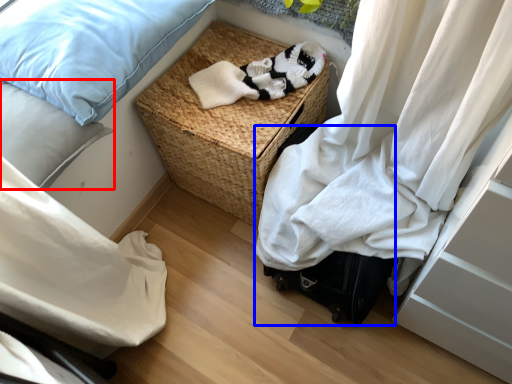
Question: Which object is closer to the camera taking this photo, pillow (highlighted by a red box) or luggage (highlighted by a blue box)?

Choices:
 (A) pillow
 (B) luggage

Answer: (A)